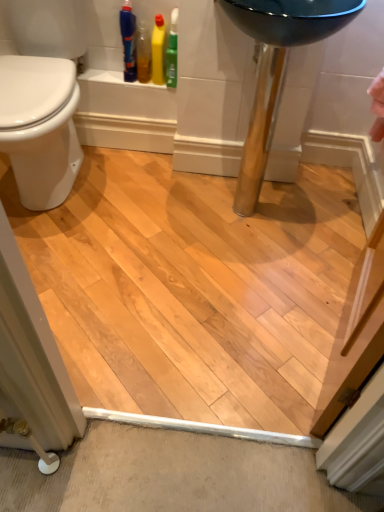
How much space does translucent plastic bottle at upper left, the first cleaning product when ordered from left to right, occupy horizontally?

The width of translucent plastic bottle at upper left, the first cleaning product when ordered from left to right, is 4.01 inches.

Describe the element at coordinates (158, 50) in the screenshot. I see `yellow glossy bottle at upper left, placed as the 2th cleaning product when sorted from left to right` at that location.

Image resolution: width=384 pixels, height=512 pixels. What do you see at coordinates (128, 41) in the screenshot?
I see `blue plastic bottle at upper left` at bounding box center [128, 41].

Describe the element at coordinates (40, 127) in the screenshot. I see `white glossy bidet at left` at that location.

The width and height of the screenshot is (384, 512). Find the location of `translucent plastic bottle at upper left, positioned as the second cleaning product in right-to-left order`. translucent plastic bottle at upper left, positioned as the second cleaning product in right-to-left order is located at coordinates (143, 53).

Based on their sizes in the image, would you say yellow glossy bottle at upper left, placed as the 2th cleaning product when sorted from left to right, is bigger or smaller than white glossy bidet at left?

In the image, yellow glossy bottle at upper left, placed as the 2th cleaning product when sorted from left to right, appears to be smaller than white glossy bidet at left.

Visually, is yellow glossy bottle at upper left, placed as the 2th cleaning product when sorted from left to right, positioned to the left or to the right of white glossy bidet at left?

In the image, yellow glossy bottle at upper left, placed as the 2th cleaning product when sorted from left to right, appears on the right side of white glossy bidet at left.

Can you confirm if yellow glossy bottle at upper left, marked as the 1th cleaning product in a right-to-left arrangement, is wider than white glossy bidet at left?

No.

Which is less distant, (154, 60) or (31, 116)?

Point (154, 60).

Which point is more distant from viewer, (65, 195) or (135, 28)?

The point (65, 195) is behind.

Is white glossy bidet at left smaller than blue plastic bottle at upper left?

Incorrect, white glossy bidet at left is not smaller in size than blue plastic bottle at upper left.

Considering the sizes of objects white glossy bidet at left and blue plastic bottle at upper left in the image provided, who is taller, white glossy bidet at left or blue plastic bottle at upper left?

white glossy bidet at left.

Does point (138, 71) come closer to viewer compared to point (64, 80)?

No, it is not.

Based on their positions, is translucent plastic bottle at upper left, the first cleaning product when ordered from left to right, located to the left or right of white glossy bidet at left?

In the image, translucent plastic bottle at upper left, the first cleaning product when ordered from left to right, appears on the right side of white glossy bidet at left.

From the image's perspective, is translucent plastic bottle at upper left, positioned as the second cleaning product in right-to-left order, positioned above or below white glossy bidet at left?

translucent plastic bottle at upper left, positioned as the second cleaning product in right-to-left order, is situated higher than white glossy bidet at left in the image.

How different are the orientations of translucent plastic bottle at upper left, positioned as the second cleaning product in right-to-left order, and white glossy bidet at left in degrees?

The facing directions of translucent plastic bottle at upper left, positioned as the second cleaning product in right-to-left order, and white glossy bidet at left are 2.97 degrees apart.

In terms of height, does translucent plastic bottle at upper left, the first cleaning product when ordered from left to right, look taller or shorter compared to yellow glossy bottle at upper left, placed as the 2th cleaning product when sorted from left to right?

In the image, translucent plastic bottle at upper left, the first cleaning product when ordered from left to right, appears to be shorter than yellow glossy bottle at upper left, placed as the 2th cleaning product when sorted from left to right.

Considering the relative sizes of translucent plastic bottle at upper left, the first cleaning product when ordered from left to right, and yellow glossy bottle at upper left, marked as the 1th cleaning product in a right-to-left arrangement, in the image provided, is translucent plastic bottle at upper left, the first cleaning product when ordered from left to right, wider than yellow glossy bottle at upper left, marked as the 1th cleaning product in a right-to-left arrangement,?

No, translucent plastic bottle at upper left, the first cleaning product when ordered from left to right, is not wider than yellow glossy bottle at upper left, marked as the 1th cleaning product in a right-to-left arrangement.

Looking at this image, how many degrees apart are the facing directions of translucent plastic bottle at upper left, the first cleaning product when ordered from left to right, and yellow glossy bottle at upper left, placed as the 2th cleaning product when sorted from left to right?

translucent plastic bottle at upper left, the first cleaning product when ordered from left to right, and yellow glossy bottle at upper left, placed as the 2th cleaning product when sorted from left to right, are facing 3.19 degrees away from each other.

Which is closer to the camera, [142,23] or [160,26]?

Point [142,23] is positioned farther from the camera compared to point [160,26].

Identify the location of toiletry that is on the left side of translucent plastic bottle at upper left, the first cleaning product when ordered from left to right. (128, 41).

Is blue plastic bottle at upper left at the back of translucent plastic bottle at upper left, positioned as the second cleaning product in right-to-left order?

No.

Could you measure the distance between translucent plastic bottle at upper left, the first cleaning product when ordered from left to right, and blue plastic bottle at upper left?

They are 1.67 inches apart.

From a real-world perspective, is translucent plastic bottle at upper left, the first cleaning product when ordered from left to right, positioned above or below blue plastic bottle at upper left?

Clearly, from a real-world perspective, translucent plastic bottle at upper left, the first cleaning product when ordered from left to right, is below blue plastic bottle at upper left.

From a real-world perspective, who is located lower, white glossy bidet at left or yellow glossy bottle at upper left, placed as the 2th cleaning product when sorted from left to right?

white glossy bidet at left.

Do you think white glossy bidet at left is within yellow glossy bottle at upper left, marked as the 1th cleaning product in a right-to-left arrangement, or outside of it?

white glossy bidet at left is spatially situated outside yellow glossy bottle at upper left, marked as the 1th cleaning product in a right-to-left arrangement.

From the image's perspective, which object appears higher, white glossy bidet at left or yellow glossy bottle at upper left, placed as the 2th cleaning product when sorted from left to right?

yellow glossy bottle at upper left, placed as the 2th cleaning product when sorted from left to right, from the image's perspective.

In the scene shown: Which object is wider, white glossy bidet at left or yellow glossy bottle at upper left, marked as the 1th cleaning product in a right-to-left arrangement?

white glossy bidet at left is wider.

From a real-world perspective, starting from the white glossy bidet at left, which cleaning product is the 1st one vertically above it? Please provide its 2D coordinates.

[(143, 53)]

From a real-world perspective, is white glossy bidet at left physically below translucent plastic bottle at upper left, the first cleaning product when ordered from left to right?

Yes, from a real-world perspective, white glossy bidet at left is beneath translucent plastic bottle at upper left, the first cleaning product when ordered from left to right.

Between white glossy bidet at left and translucent plastic bottle at upper left, positioned as the second cleaning product in right-to-left order, which one has less height?

With less height is translucent plastic bottle at upper left, positioned as the second cleaning product in right-to-left order.

Looking at this image, from the image's perspective, which object appears higher, white glossy bidet at left or translucent plastic bottle at upper left, the first cleaning product when ordered from left to right?

translucent plastic bottle at upper left, the first cleaning product when ordered from left to right.

Image resolution: width=384 pixels, height=512 pixels. In order to click on bidet that appears below the yellow glossy bottle at upper left, placed as the 2th cleaning product when sorted from left to right (from the image's perspective) in this screenshot , I will do `click(40, 127)`.

This screenshot has height=512, width=384. I want to click on bidet lying on the left of blue plastic bottle at upper left, so click(x=40, y=127).

From the image, which object appears to be farther from yellow glossy bottle at upper left, placed as the 2th cleaning product when sorted from left to right, translucent plastic bottle at upper left, the first cleaning product when ordered from left to right, or blue plastic bottle at upper left?

blue plastic bottle at upper left is further to yellow glossy bottle at upper left, placed as the 2th cleaning product when sorted from left to right.

Based on their spatial positions, is white glossy bidet at left or yellow glossy bottle at upper left, placed as the 2th cleaning product when sorted from left to right, closer to blue plastic bottle at upper left?

Based on the image, yellow glossy bottle at upper left, placed as the 2th cleaning product when sorted from left to right, appears to be nearer to blue plastic bottle at upper left.

From the image, which object appears to be farther from translucent plastic bottle at upper left, the first cleaning product when ordered from left to right, yellow glossy bottle at upper left, marked as the 1th cleaning product in a right-to-left arrangement, or white glossy bidet at left?

white glossy bidet at left is further to translucent plastic bottle at upper left, the first cleaning product when ordered from left to right.

Based on their spatial positions, is white glossy bidet at left or blue plastic bottle at upper left closer to yellow glossy bottle at upper left, placed as the 2th cleaning product when sorted from left to right?

The object closer to yellow glossy bottle at upper left, placed as the 2th cleaning product when sorted from left to right, is blue plastic bottle at upper left.

Based on their spatial positions, is white glossy bidet at left or translucent plastic bottle at upper left, the first cleaning product when ordered from left to right, closer to yellow glossy bottle at upper left, marked as the 1th cleaning product in a right-to-left arrangement?

Among the two, translucent plastic bottle at upper left, the first cleaning product when ordered from left to right, is located nearer to yellow glossy bottle at upper left, marked as the 1th cleaning product in a right-to-left arrangement.

Considering their positions, is translucent plastic bottle at upper left, the first cleaning product when ordered from left to right, positioned further to yellow glossy bottle at upper left, marked as the 1th cleaning product in a right-to-left arrangement, than white glossy bidet at left?

Among the two, white glossy bidet at left is located further to yellow glossy bottle at upper left, marked as the 1th cleaning product in a right-to-left arrangement.

From the image, which object appears to be farther from white glossy bidet at left, blue plastic bottle at upper left or yellow glossy bottle at upper left, marked as the 1th cleaning product in a right-to-left arrangement?

yellow glossy bottle at upper left, marked as the 1th cleaning product in a right-to-left arrangement, lies further to white glossy bidet at left than the other object.

Looking at the image, which one is located closer to blue plastic bottle at upper left, white glossy bidet at left or translucent plastic bottle at upper left, the first cleaning product when ordered from left to right?

translucent plastic bottle at upper left, the first cleaning product when ordered from left to right, is positioned closer to the anchor blue plastic bottle at upper left.

Where is `cleaning product between white glossy bidet at left and translucent plastic bottle at upper left, positioned as the second cleaning product in right-to-left order, along the z-axis`? The height and width of the screenshot is (512, 384). cleaning product between white glossy bidet at left and translucent plastic bottle at upper left, positioned as the second cleaning product in right-to-left order, along the z-axis is located at coordinates (158, 50).

This screenshot has height=512, width=384. What are the coordinates of `toiletry located between white glossy bidet at left and translucent plastic bottle at upper left, the first cleaning product when ordered from left to right, in the depth direction` in the screenshot? It's located at (128, 41).

Image resolution: width=384 pixels, height=512 pixels. I want to click on cleaning product between blue plastic bottle at upper left and yellow glossy bottle at upper left, placed as the 2th cleaning product when sorted from left to right, in the horizontal direction, so click(x=143, y=53).

Image resolution: width=384 pixels, height=512 pixels. Identify the location of toiletry between white glossy bidet at left and yellow glossy bottle at upper left, placed as the 2th cleaning product when sorted from left to right, from front to back. (128, 41).